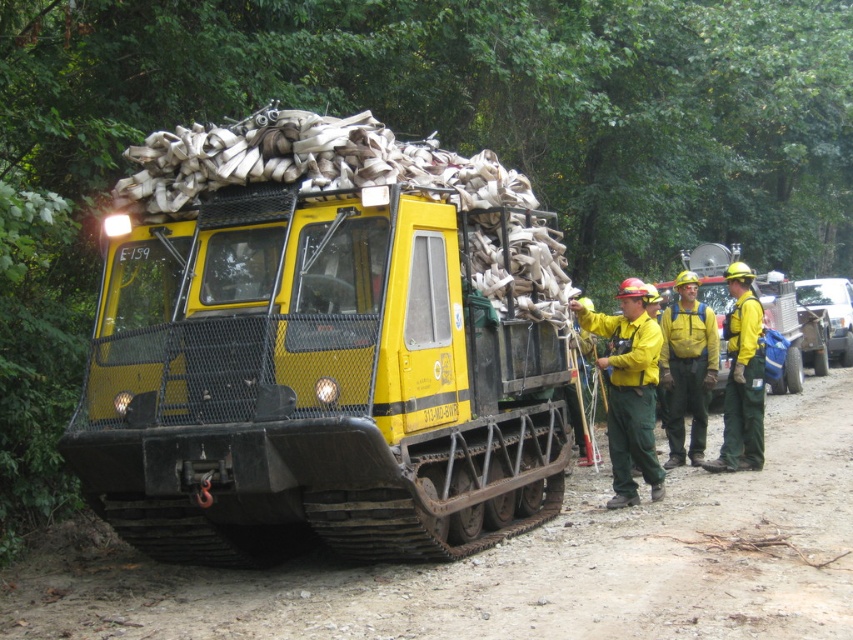
Is yellow matte truck at center positioned in front of yellow/yellow-green uniform at center-right?

That is True.

Between yellow matte truck at center and yellow/yellow-green uniform at center-right, which one is positioned lower?

yellow/yellow-green uniform at center-right is below.

Is point (502, 464) in front of point (703, 305)?

That is True.

Identify the location of yellow matte truck at center. (323, 348).

Between point (471, 563) and point (660, 321), which one is positioned in front?

Point (471, 563) is more forward.

This screenshot has height=640, width=853. Identify the location of dirt track at lower center. (515, 564).

Is yellow matte truck at center further to the viewer compared to dirt track at lower center?

Yes, yellow matte truck at center is further from the viewer.

Describe the element at coordinates (323, 348) in the screenshot. I see `yellow matte truck at center` at that location.

Image resolution: width=853 pixels, height=640 pixels. What are the coordinates of `yellow matte truck at center` in the screenshot? It's located at (323, 348).